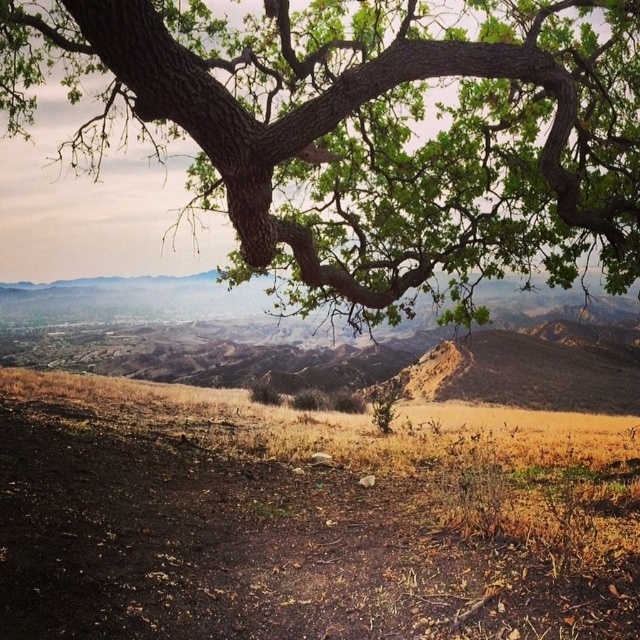
Consider the image. You are standing at the point marked by point (365,134) in the image. Looking around, you see the green rough bark tree at upper center. Which direction should you walk to reach the tree?

Since point (365,134) is the location of the green rough bark tree at upper center, you are already at the tree. There is no need to walk anywhere else.

You are a hiker standing on the brown dry soil at lower center looking up at the green rough bark tree at upper center. Which object is taller?

The green rough bark tree at upper center is taller than the brown dry soil at lower center.

You are standing on the brown dry soil at lower center and want to reach the green rough bark tree at upper center. Which direction should you move to get closer to the tree?

You should move upward because the green rough bark tree at upper center is further to the viewer than the brown dry soil at lower center, meaning it is closer to you and located above the soil in the image.